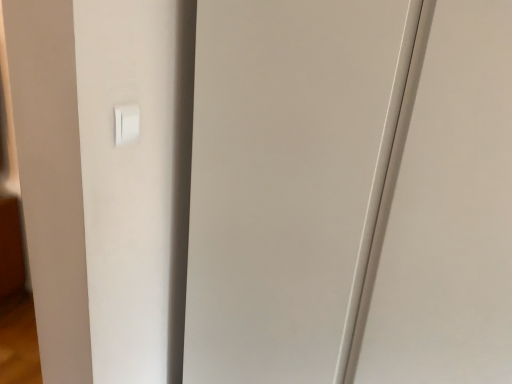
Question: From the image's perspective, is transparent glass door at center on white plastic light switch at upper left?

Choices:
 (A) no
 (B) yes

Answer: (A)

Question: Is transparent glass door at center thinner than white plastic light switch at upper left?

Choices:
 (A) yes
 (B) no

Answer: (B)

Question: Considering the relative positions of transparent glass door at center and white plastic light switch at upper left in the image provided, is transparent glass door at center behind white plastic light switch at upper left?

Choices:
 (A) yes
 (B) no

Answer: (B)

Question: From the image's perspective, is transparent glass door at center located beneath white plastic light switch at upper left?

Choices:
 (A) yes
 (B) no

Answer: (A)

Question: From a real-world perspective, is transparent glass door at center positioned under white plastic light switch at upper left based on gravity?

Choices:
 (A) no
 (B) yes

Answer: (B)

Question: Is transparent glass door at center directly adjacent to white plastic light switch at upper left?

Choices:
 (A) yes
 (B) no

Answer: (B)

Question: Is white plastic light switch at upper left positioned with its back to transparent glass door at center?

Choices:
 (A) no
 (B) yes

Answer: (A)

Question: From the image's perspective, is white plastic light switch at upper left located above transparent glass door at center?

Choices:
 (A) no
 (B) yes

Answer: (B)

Question: From a real-world perspective, is white plastic light switch at upper left physically below transparent glass door at center?

Choices:
 (A) yes
 (B) no

Answer: (B)

Question: Considering the relative sizes of white plastic light switch at upper left and transparent glass door at center in the image provided, is white plastic light switch at upper left taller than transparent glass door at center?

Choices:
 (A) no
 (B) yes

Answer: (A)

Question: Does white plastic light switch at upper left have a smaller size compared to transparent glass door at center?

Choices:
 (A) yes
 (B) no

Answer: (A)

Question: Does white plastic light switch at upper left have a lesser width compared to transparent glass door at center?

Choices:
 (A) yes
 (B) no

Answer: (A)

Question: Is white plastic light switch at upper left taller or shorter than transparent glass door at center?

Choices:
 (A) short
 (B) tall

Answer: (A)